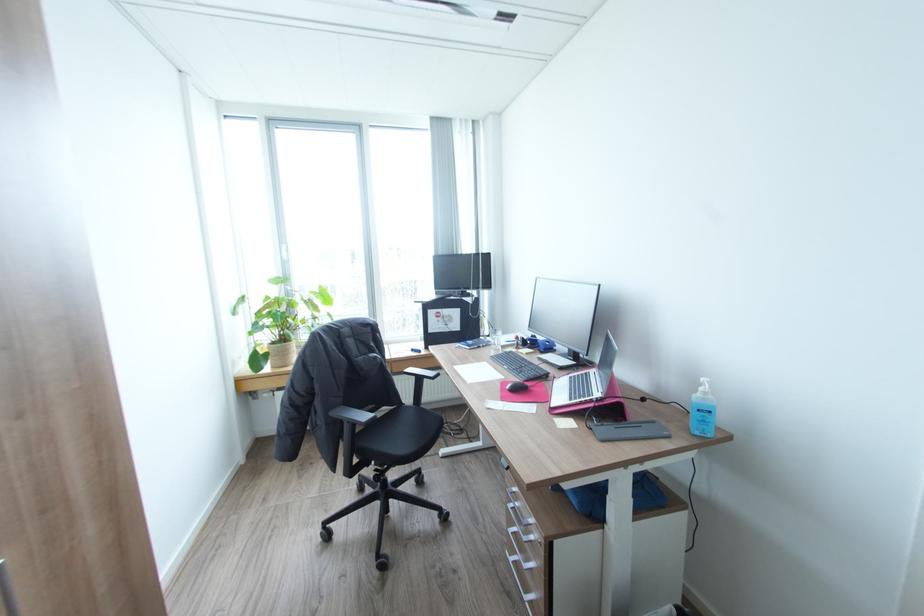
This screenshot has width=924, height=616. Describe the element at coordinates (402, 432) in the screenshot. I see `a black chair surface` at that location.